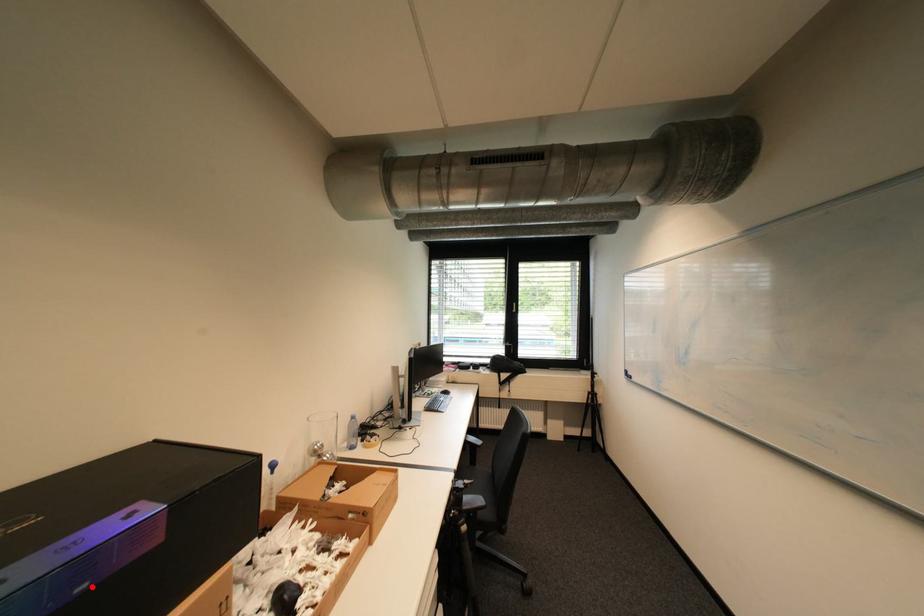
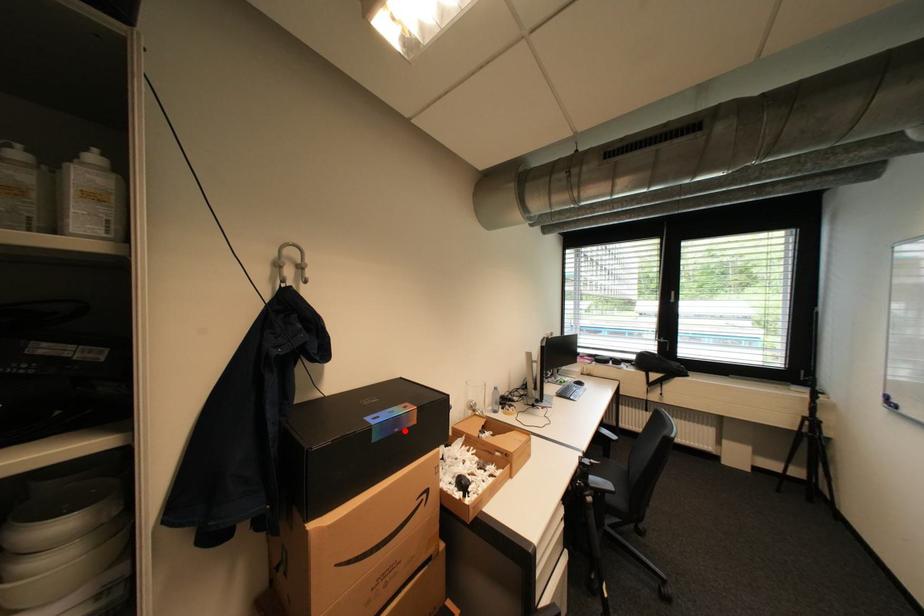
From the picture: I am providing you with two images of the same scene from different viewpoints. A red point is marked on the first image and another point is marked on the second image. Are the points marked in image1 and image2 representing the same 3D position?

Yes